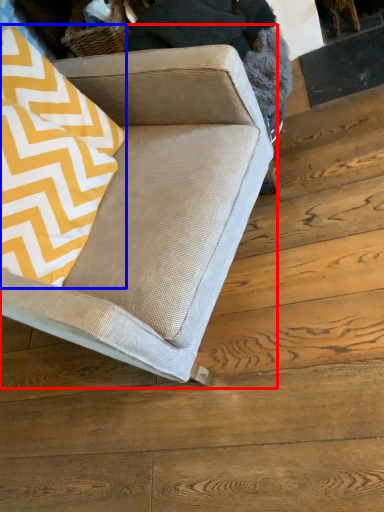
Question: Which object is further to the camera taking this photo, studio couch (highlighted by a red box) or throw pillow (highlighted by a blue box)?

Choices:
 (A) studio couch
 (B) throw pillow

Answer: (B)